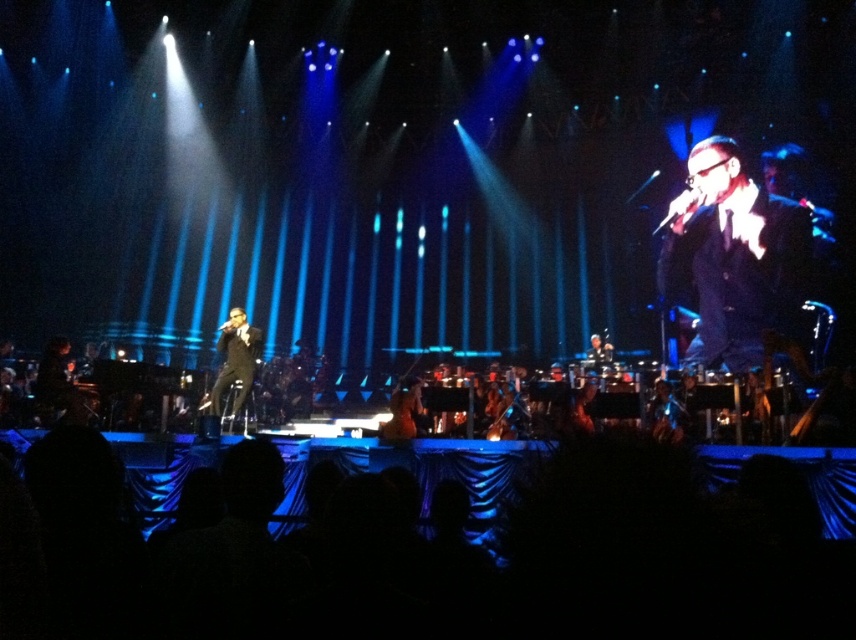
Can you confirm if black glossy suit at center is wider than black glossy suit at left?

Incorrect, black glossy suit at center's width does not surpass black glossy suit at left's.

Is black glossy suit at center to the left of black glossy suit at left from the viewer's perspective?

In fact, black glossy suit at center is to the right of black glossy suit at left.

Which is behind, point (691, 156) or point (251, 337)?

The point (691, 156) is more distant.

This screenshot has height=640, width=856. In order to click on black glossy suit at center in this screenshot , I will do `click(735, 259)`.